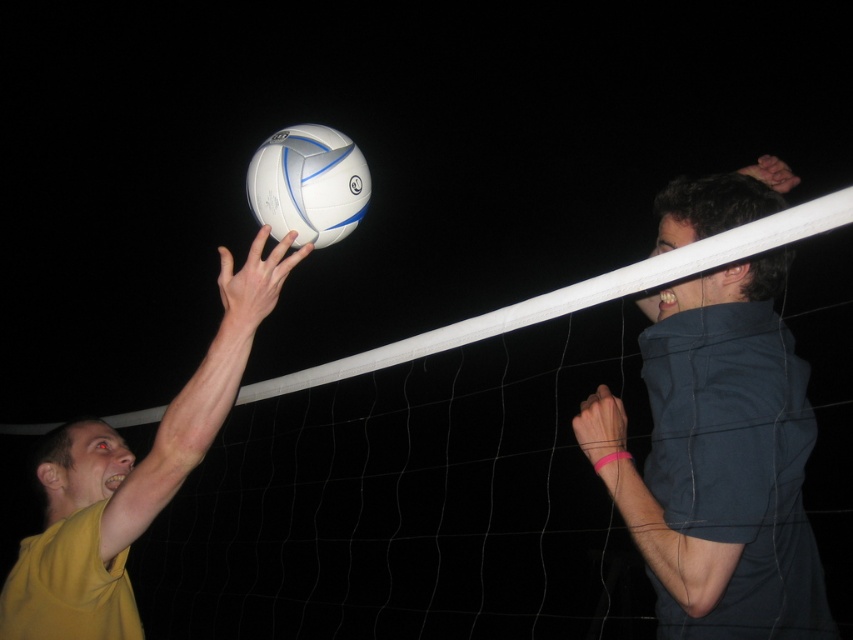
Question: Can you confirm if yellow matte shirt at upper left is positioned below white matte/vinyl volleyball at upper center?

Choices:
 (A) no
 (B) yes

Answer: (B)

Question: Can you confirm if dark blue shirt at upper right is thinner than yellow matte shirt at upper left?

Choices:
 (A) yes
 (B) no

Answer: (A)

Question: Which object is closer to the camera taking this photo?

Choices:
 (A) yellow matte shirt at upper left
 (B) dark blue shirt at upper right

Answer: (B)

Question: Which point is closer to the camera?

Choices:
 (A) yellow matte shirt at upper left
 (B) white matte/vinyl volleyball at upper center
 (C) dark blue shirt at upper right

Answer: (C)

Question: Does yellow matte shirt at upper left have a smaller size compared to white matte/vinyl volleyball at upper center?

Choices:
 (A) no
 (B) yes

Answer: (A)

Question: Which point is farther to the camera?

Choices:
 (A) yellow matte shirt at upper left
 (B) dark blue shirt at upper right
 (C) white matte/vinyl volleyball at upper center

Answer: (C)